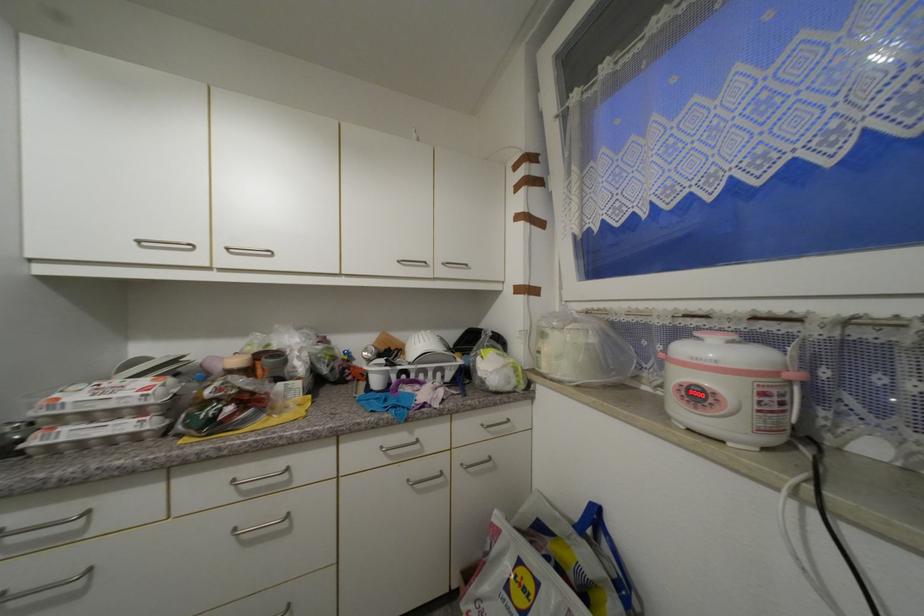
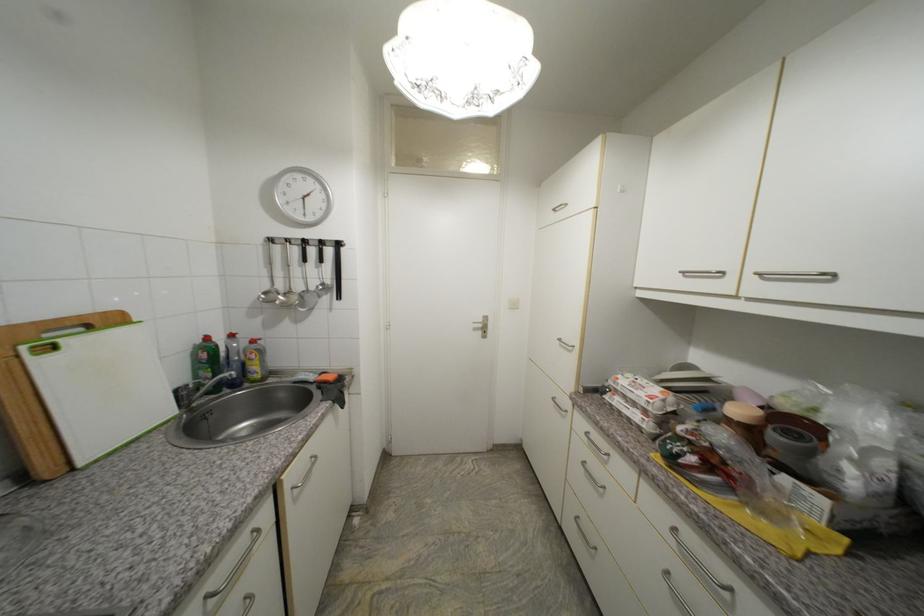
The point at (64, 400) is marked in the first image. Where is the corresponding point in the second image?

(623, 379)